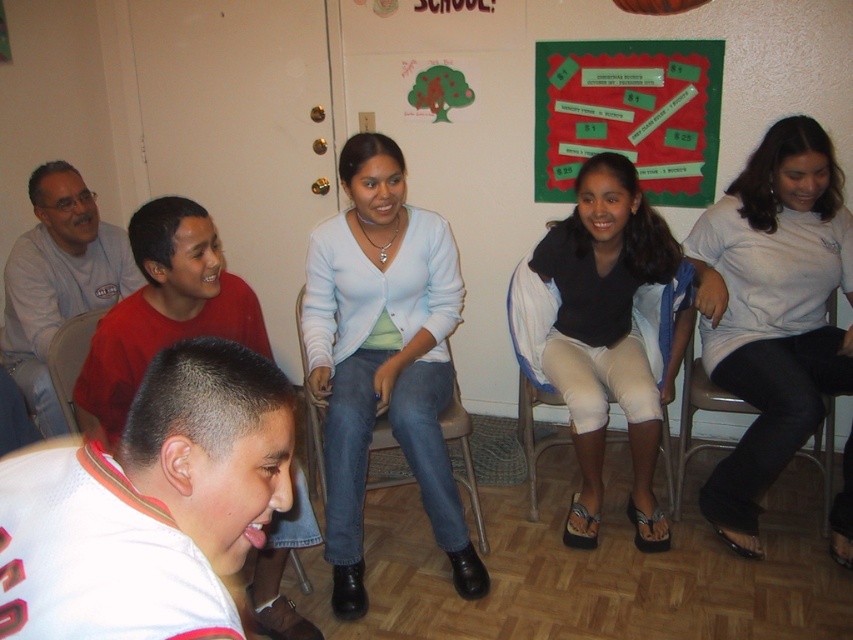
Question: Which point appears farthest from the camera in this image?

Choices:
 (A) (86, 333)
 (B) (634, 81)
 (C) (753, 157)

Answer: (B)

Question: Which object is the farthest from the white matte shirt at lower left?

Choices:
 (A) matte plastic chair at left
 (B) green paperboard at upper center

Answer: (B)

Question: Which of the following is the farthest from the observer?

Choices:
 (A) metallic silver chair at center
 (B) white matte shirt at lower left

Answer: (A)

Question: Does light blue cardigan at center appear on the right side of white matte shirt at lower left?

Choices:
 (A) no
 (B) yes

Answer: (B)

Question: Is metallic silver chair at center thinner than matte plastic chair at left?

Choices:
 (A) yes
 (B) no

Answer: (B)

Question: From the image, what is the correct spatial relationship of white matte shirt at lower left in relation to green paperboard at upper center?

Choices:
 (A) right
 (B) left

Answer: (B)